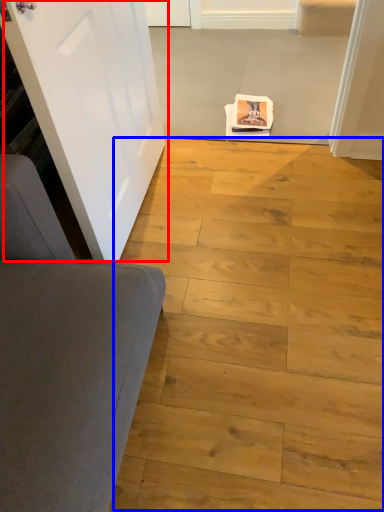
Question: Which object appears farthest to the camera in this image, door (highlighted by a red box) or plank (highlighted by a blue box)?

Choices:
 (A) door
 (B) plank

Answer: (B)